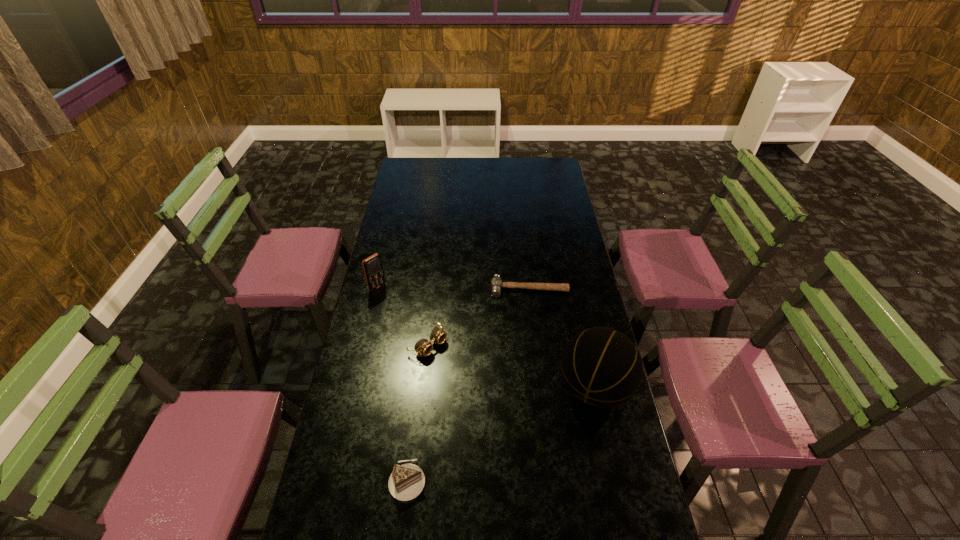
The height and width of the screenshot is (540, 960). In order to click on hammer located in the right edge section of the desktop in this screenshot , I will do `click(496, 283)`.

This screenshot has width=960, height=540. I want to click on vacant space at the far edge of the desktop, so click(x=459, y=165).

The image size is (960, 540). In order to click on vacant space at the left edge of the desktop in this screenshot , I will do `click(333, 452)`.

This screenshot has height=540, width=960. In the image, there is a desktop. In order to click on free space at the right edge in this screenshot , I will do `click(539, 202)`.

I want to click on free space at the far left corner, so click(430, 158).

This screenshot has height=540, width=960. Find the location of `vacant space at the near left corner of the desktop`. vacant space at the near left corner of the desktop is located at coordinates (318, 523).

Identify the location of free space at the far right corner of the desktop. Image resolution: width=960 pixels, height=540 pixels. (536, 170).

Locate an element on the screen. The image size is (960, 540). vacant area that lies between the basketball and the chocolate cake is located at coordinates (500, 434).

In order to click on free space between the fourth shortest object and the chocolate cake in this screenshot , I will do `click(393, 384)`.

The width and height of the screenshot is (960, 540). I want to click on free point between the basketball and the goggles, so click(511, 366).